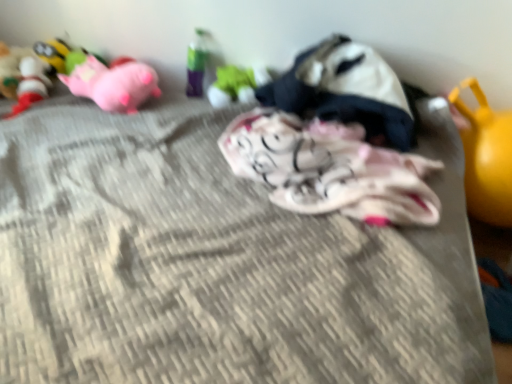
Question: Does translucent plastic bottle at upper center, which ranks as the 5th toy in right-to-left order, have a lesser width compared to pink plush pig at upper left, acting as the third toy starting from the left?

Choices:
 (A) yes
 (B) no

Answer: (A)

Question: Are translucent plastic bottle at upper center, which ranks as the 5th toy in right-to-left order, and pink plush pig at upper left, acting as the third toy starting from the left, located far from each other?

Choices:
 (A) no
 (B) yes

Answer: (A)

Question: Is translucent plastic bottle at upper center, which is the fourth toy from left to right, next to pink plush pig at upper left, the sixth toy when ordered from right to left?

Choices:
 (A) yes
 (B) no

Answer: (B)

Question: From a real-world perspective, is translucent plastic bottle at upper center, which ranks as the 5th toy in right-to-left order, below pink plush pig at upper left, acting as the third toy starting from the left?

Choices:
 (A) yes
 (B) no

Answer: (B)

Question: Is translucent plastic bottle at upper center, which is the fourth toy from left to right, positioned before pink plush pig at upper left, the sixth toy when ordered from right to left?

Choices:
 (A) no
 (B) yes

Answer: (A)

Question: In the image, is pink plush pig at upper left, acting as the third toy starting from the left, positioned in front of or behind plush yellow toy at upper left, which appears as the 7th toy when viewed from the right?

Choices:
 (A) behind
 (B) front

Answer: (B)

Question: Is point (94, 74) closer or farther from the camera than point (41, 57)?

Choices:
 (A) farther
 (B) closer

Answer: (B)

Question: In terms of width, does pink plush pig at upper left, acting as the third toy starting from the left, look wider or thinner when compared to plush yellow toy at upper left, which is counted as the second toy, starting from the left?

Choices:
 (A) wide
 (B) thin

Answer: (A)

Question: Choose the correct answer: Is pink plush pig at upper left, acting as the third toy starting from the left, inside plush yellow toy at upper left, which appears as the 7th toy when viewed from the right, or outside it?

Choices:
 (A) inside
 (B) outside

Answer: (B)

Question: Is yellow rubber ball at right, marked as the 8th toy in a left-to-right arrangement, bigger or smaller than white cotton blanket at center, the second toy from the right?

Choices:
 (A) small
 (B) big

Answer: (A)

Question: In terms of width, does yellow rubber ball at right, the 1th toy viewed from the right, look wider or thinner when compared to white cotton blanket at center, which is counted as the seventh toy, starting from the left?

Choices:
 (A) wide
 (B) thin

Answer: (B)

Question: From the image's perspective, is yellow rubber ball at right, marked as the 8th toy in a left-to-right arrangement, located above or below white cotton blanket at center, which is counted as the seventh toy, starting from the left?

Choices:
 (A) above
 (B) below

Answer: (B)

Question: Considering the positions of yellow rubber ball at right, marked as the 8th toy in a left-to-right arrangement, and white cotton blanket at center, which is counted as the seventh toy, starting from the left, in the image, is yellow rubber ball at right, marked as the 8th toy in a left-to-right arrangement, taller or shorter than white cotton blanket at center, which is counted as the seventh toy, starting from the left,?

Choices:
 (A) tall
 (B) short

Answer: (A)

Question: Considering their positions, is translucent plastic bottle at upper center, which is the fourth toy from left to right, located in front of or behind textured fabric mattress at center?

Choices:
 (A) behind
 (B) front

Answer: (A)

Question: From the image's perspective, is translucent plastic bottle at upper center, which ranks as the 5th toy in right-to-left order, above or below textured fabric mattress at center?

Choices:
 (A) above
 (B) below

Answer: (A)